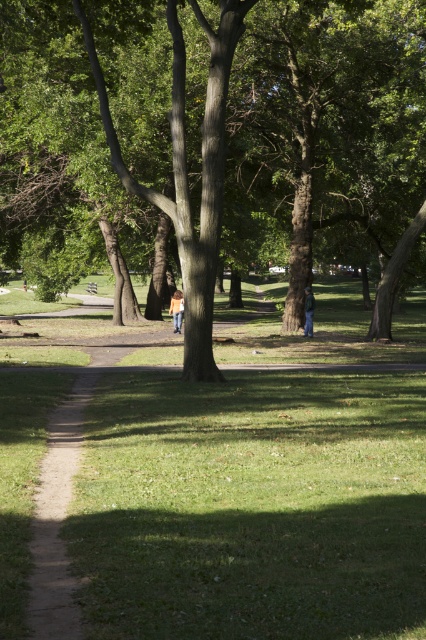
Question: Which object is the farthest from the green grass at center?

Choices:
 (A) orange fabric jacket at center
 (B) blue fabric jacket at lower center
 (C) green leafy tree at center

Answer: (B)

Question: Is green leafy tree at center above green grass at center?

Choices:
 (A) no
 (B) yes

Answer: (B)

Question: Is green grass at center below orange fabric jacket at center?

Choices:
 (A) yes
 (B) no

Answer: (A)

Question: Which object is the closest to the green grass at center?

Choices:
 (A) wooden park bench at center
 (B) blue fabric jacket at lower center

Answer: (B)

Question: Can you confirm if orange fabric jacket at center is thinner than wooden park bench at center?

Choices:
 (A) no
 (B) yes

Answer: (B)

Question: Which of these objects is positioned closest to the blue fabric jacket at lower center?

Choices:
 (A) wooden park bench at center
 (B) orange fabric jacket at center
 (C) green leafy tree at center
 (D) green grass at center

Answer: (B)